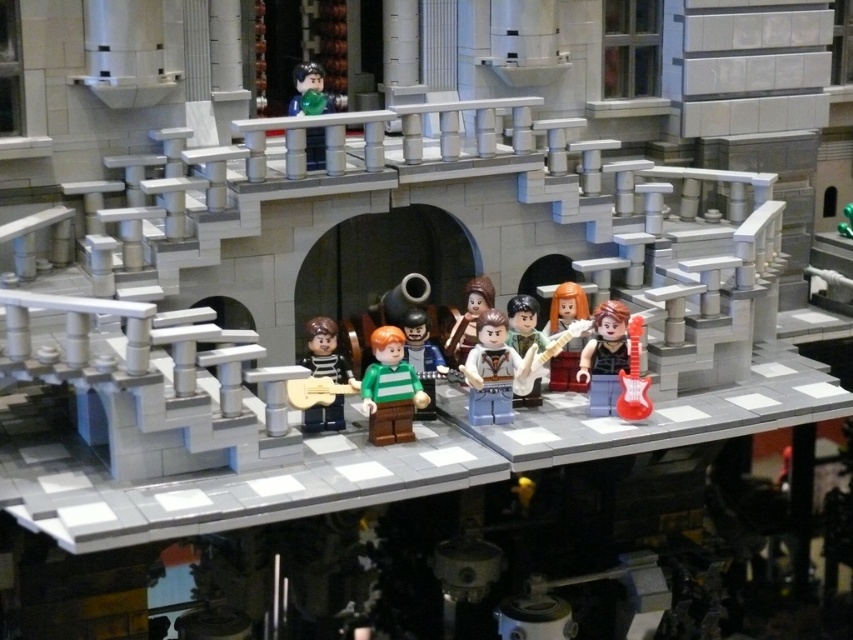
In the scene shown: You are a LEGO minifigure with a height of 4.5 inches. You want to reach the light brown wood guitar at center from the smooth brown hair at center. Can you do it without any help?

The distance between the light brown wood guitar at center and the smooth brown hair at center is 8.08 inches. Since you are 4.5 inches tall, you can easily cover that distance without any assistance.

You are a LEGO minifigure standing on the bridge and want to hand your light brown wood guitar at center to the minifigure with smooth brown hair at center. Which direction should you move to give it to them?

You should move to the left because the light brown wood guitar at center is to the right of smooth brown hair at center, so moving left will bring it closer.